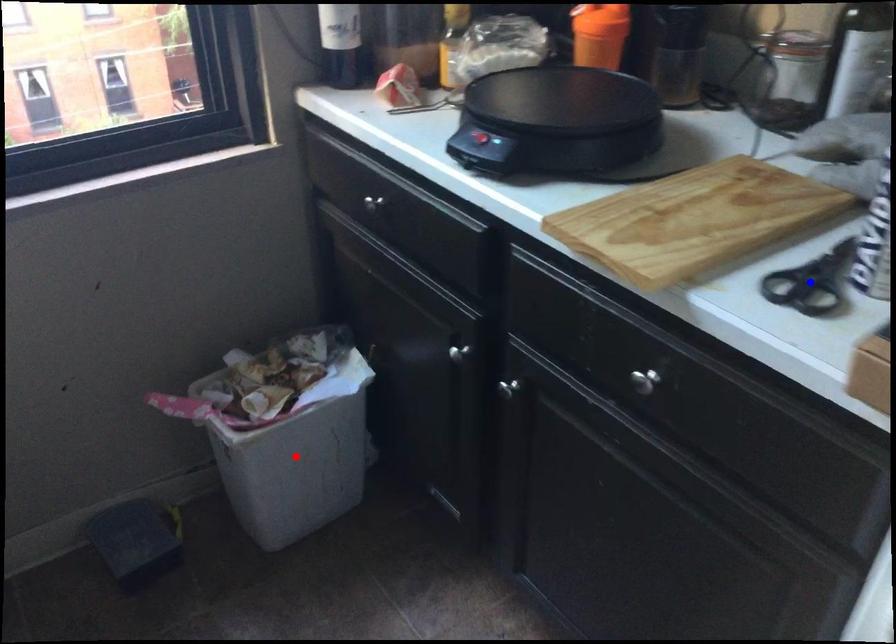
Question: Two points are marked on the image. Which point is closer to the camera?

Choices:
 (A) Blue point is closer.
 (B) Red point is closer.

Answer: (A)